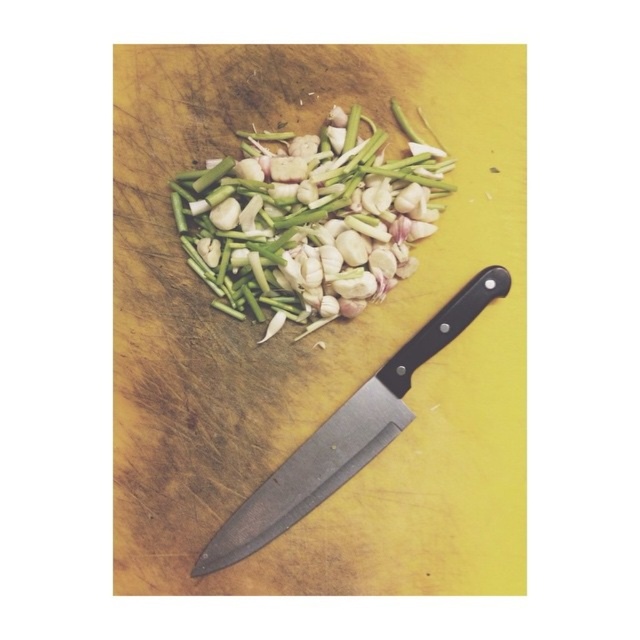
What do you see at coordinates (317, 333) in the screenshot? I see `wooden cutting board at center` at bounding box center [317, 333].

Is point (141, 449) positioned before point (376, 426)?

Yes.

Find the location of `wooden cutting board at center`. wooden cutting board at center is located at coordinates (317, 333).

In the scene shown: Can you confirm if green matte garlic at center is bigger than black matte knife at lower right?

No.

Between point (212, 280) and point (269, 536), which one is positioned in front?

Positioned in front is point (269, 536).

Who is more distant from viewer, (330, 129) or (468, 300)?

The point (330, 129) is more distant.

At what (x,y) coordinates should I click in order to perform the action: click on green matte garlic at center. Please return your answer as a coordinate pair (x, y). The image size is (640, 640). Looking at the image, I should click on (308, 220).

This screenshot has width=640, height=640. I want to click on wooden cutting board at center, so 317,333.

Can you confirm if wooden cutting board at center is positioned to the left of green matte garlic at center?

Correct, you'll find wooden cutting board at center to the left of green matte garlic at center.

I want to click on wooden cutting board at center, so click(317, 333).